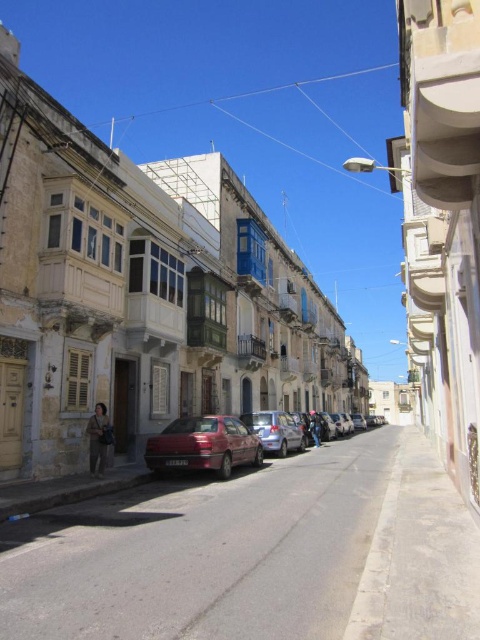
Can you confirm if shiny red car at center is positioned to the right of metallic silver car at center?

In fact, shiny red car at center is to the left of metallic silver car at center.

Is shiny red car at center smaller than metallic silver car at center?

No.

Does point (217, 444) come closer to viewer compared to point (261, 413)?

Yes.

I want to click on shiny red car at center, so click(x=203, y=445).